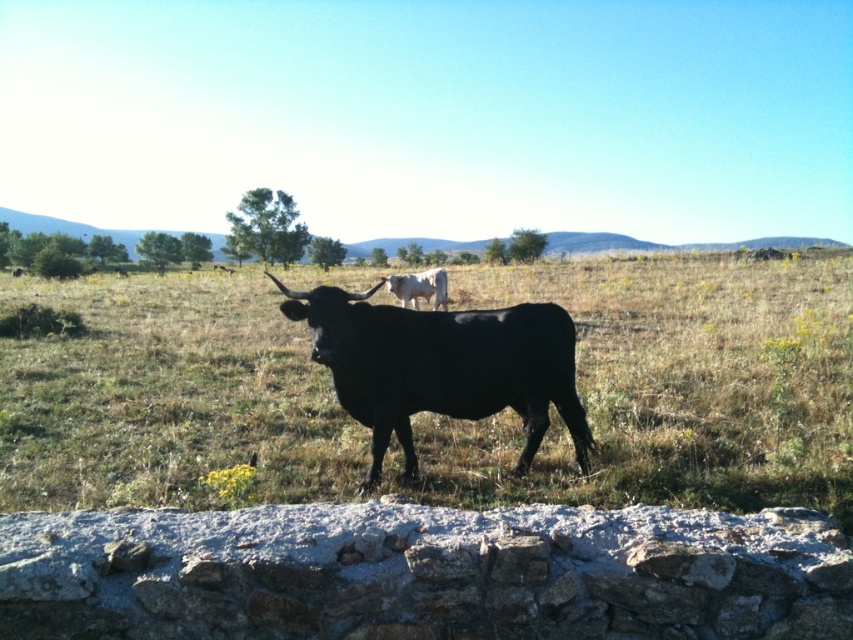
You are a photographer trying to capture both the green grass at center and the white smooth cow at center in a single shot. Based on their positions, which one would appear closer to the camera in your photo?

The green grass at center appears closer to the camera because it is positioned in front of the white smooth cow at center.

You are a photographer trying to capture the black glossy bull at center and the green grass at center in a single shot. Since you want the bull to be the main focus, where should you position the bull relative to the grass to follow the rule of thirds?

The green grass at center is positioned on the right side of black glossy bull at center, so to follow the rule of thirds, you should position the bull on the left intersection point and the grass on the right intersection point, keeping the bull as the main focus.